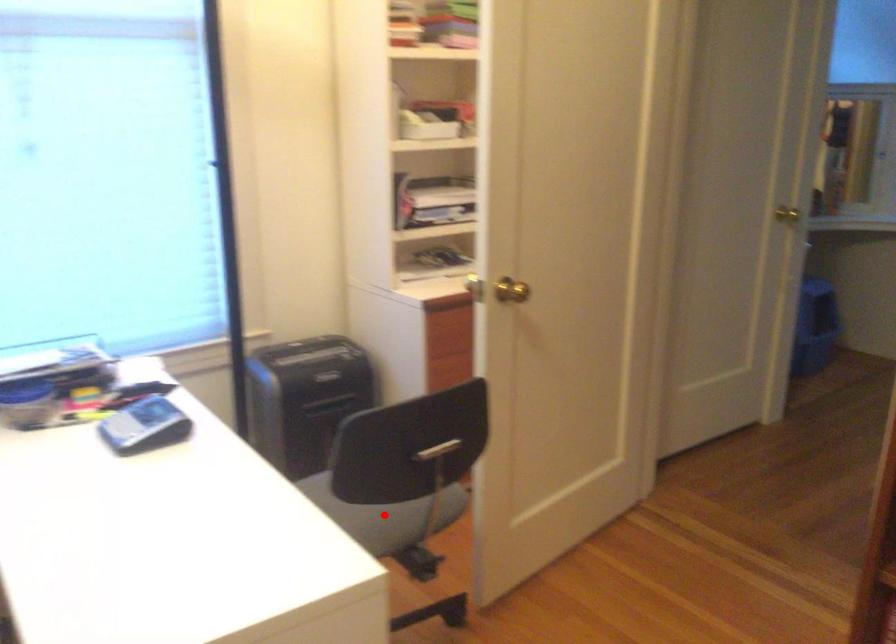
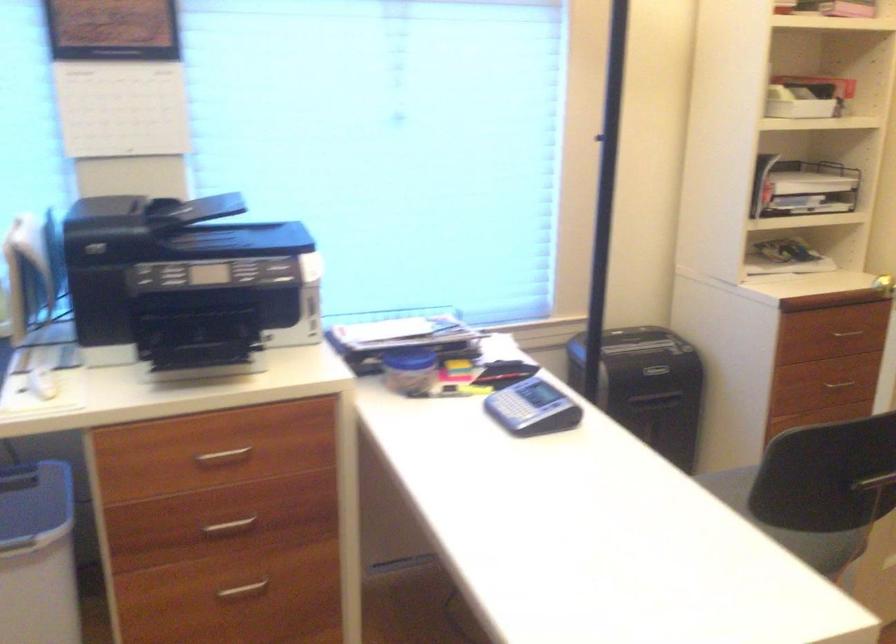
Locate, in the second image, the point that corresponds to the highlighted location in the first image.

(764, 535)